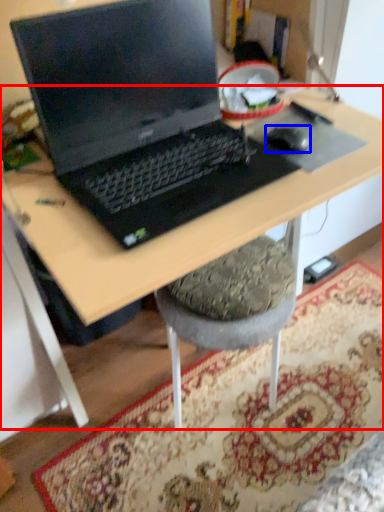
Question: Which object is further to the camera taking this photo, desk (highlighted by a red box) or mouse (highlighted by a blue box)?

Choices:
 (A) desk
 (B) mouse

Answer: (B)